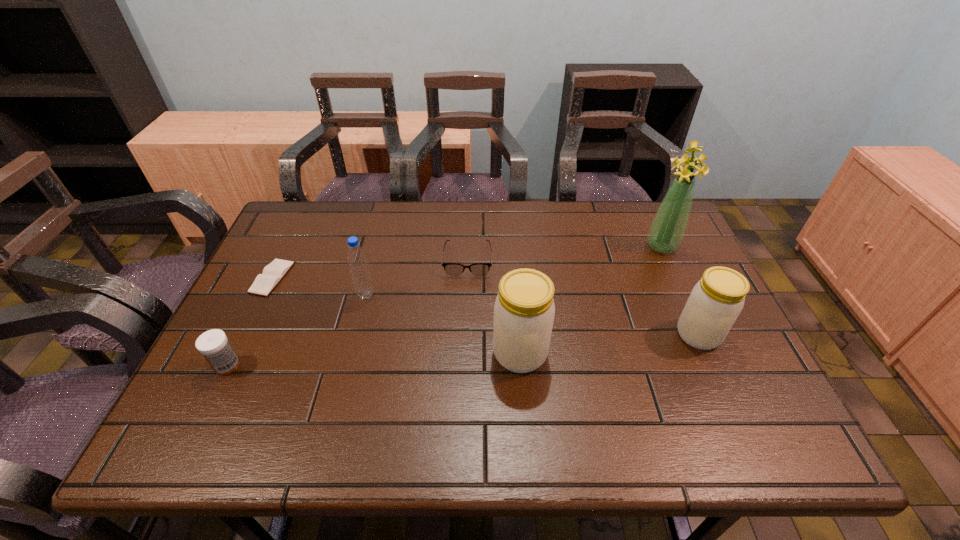
Identify the location of free point that keeps the jars evenly spaced on the left. Image resolution: width=960 pixels, height=540 pixels. (327, 373).